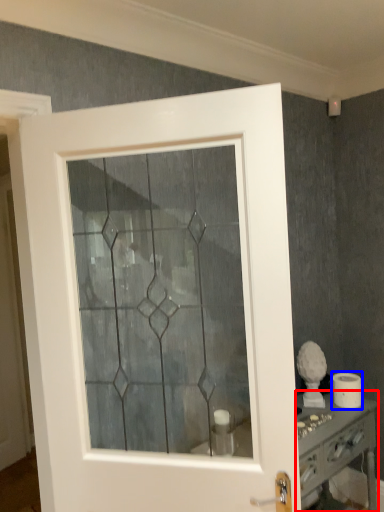
Question: Which point is further to the camera, vanity (highlighted by a red box) or toilet paper (highlighted by a blue box)?

Choices:
 (A) vanity
 (B) toilet paper

Answer: (B)